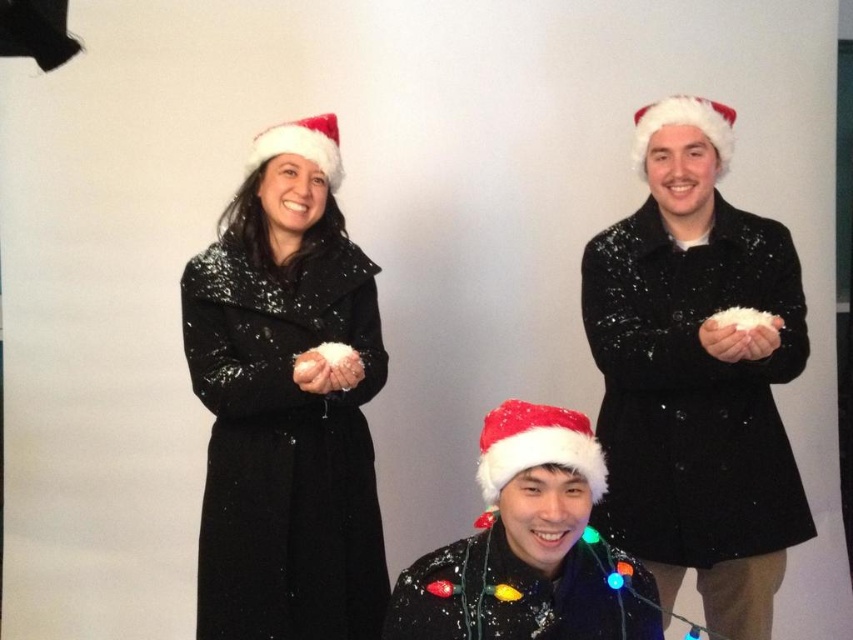
Question: Which is farther from the red velvet santa hat at center?

Choices:
 (A) glossy sequined coat at center
 (B) white fluffy santa hat at upper right
 (C) fuzzy black sweater at center
 (D) sparkly black coat at center

Answer: (B)

Question: Which point is closer to the camera taking this photo?

Choices:
 (A) (445, 605)
 (B) (509, 412)

Answer: (A)

Question: Does fuzzy black sweater at center appear under red velvet santa hat at center?

Choices:
 (A) yes
 (B) no

Answer: (A)

Question: Can you confirm if glossy sequined coat at center is positioned above fuzzy black sweater at center?

Choices:
 (A) no
 (B) yes

Answer: (B)

Question: Among these objects, which one is farthest from the camera?

Choices:
 (A) red felt santa hat at upper left
 (B) white fluffy santa hat at upper right
 (C) fuzzy black sweater at center

Answer: (A)

Question: Does white fluffy santa hat at upper right have a smaller size compared to red felt santa hat at upper left?

Choices:
 (A) yes
 (B) no

Answer: (A)